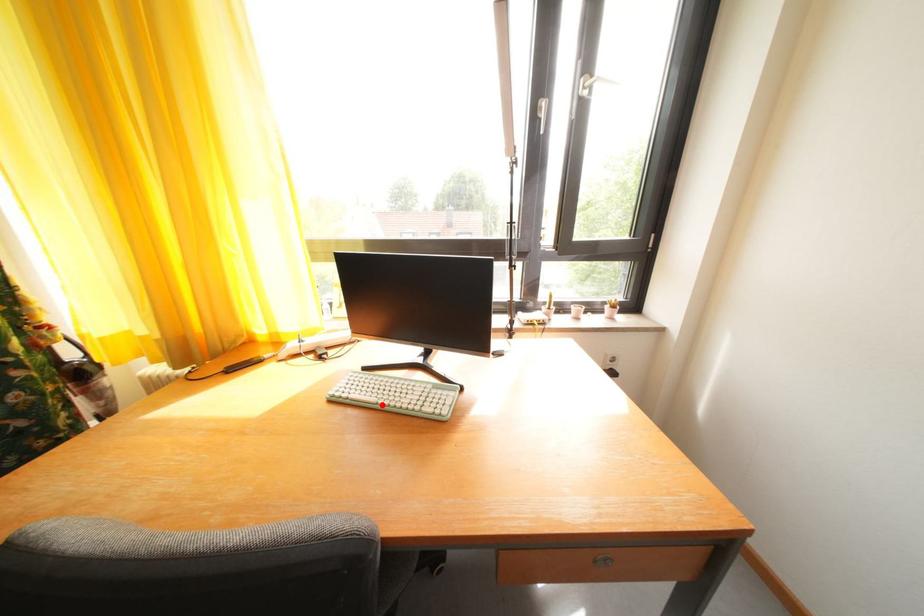
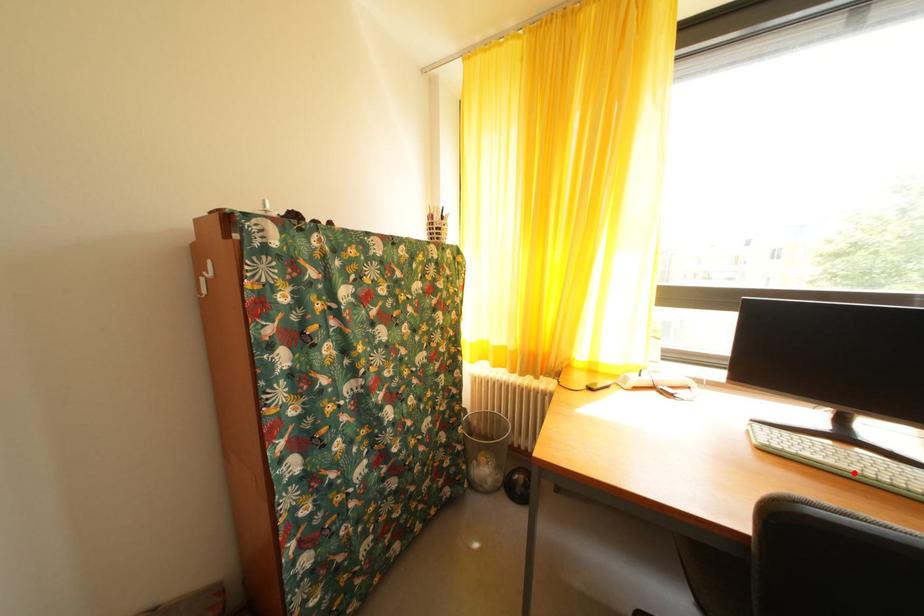
Looking at this image, I am providing you with two images of the same scene from different viewpoints. A red point is marked on the first image and another point is marked on the second image. Are the points marked in image1 and image2 representing the same 3D position?

Yes